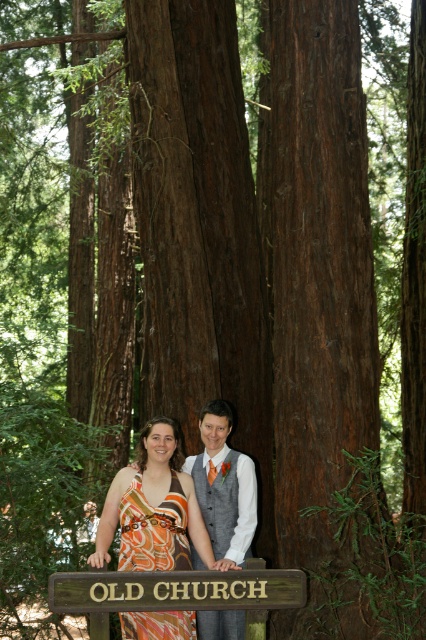
Question: Which object is farther from the camera taking this photo?

Choices:
 (A) wooden sign at center
 (B) orange printed dress at center
 (C) gray textured vest at center

Answer: (C)

Question: Does orange printed dress at center appear under gray textured vest at center?

Choices:
 (A) no
 (B) yes

Answer: (B)

Question: Which of the following is the farthest from the observer?

Choices:
 (A) (155, 525)
 (B) (207, 605)

Answer: (A)

Question: Does wooden sign at center appear over gray textured vest at center?

Choices:
 (A) yes
 (B) no

Answer: (B)

Question: Which of the following is the closest to the observer?

Choices:
 (A) click(160, 531)
 (B) click(245, 545)

Answer: (A)

Question: Is wooden sign at center smaller than gray textured vest at center?

Choices:
 (A) no
 (B) yes

Answer: (B)